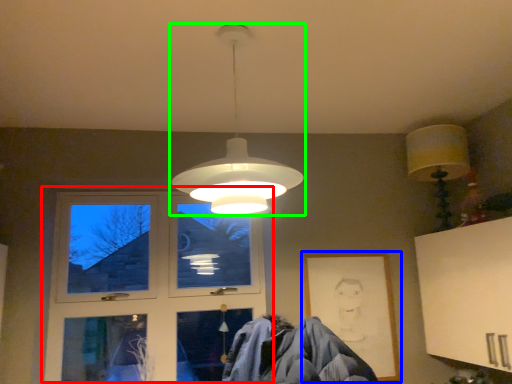
Question: Estimate the real-world distances between objects in this image. Which object is farther from window (highlighted by a red box), picture frame (highlighted by a blue box) or lamp (highlighted by a green box)?

Choices:
 (A) picture frame
 (B) lamp

Answer: (B)